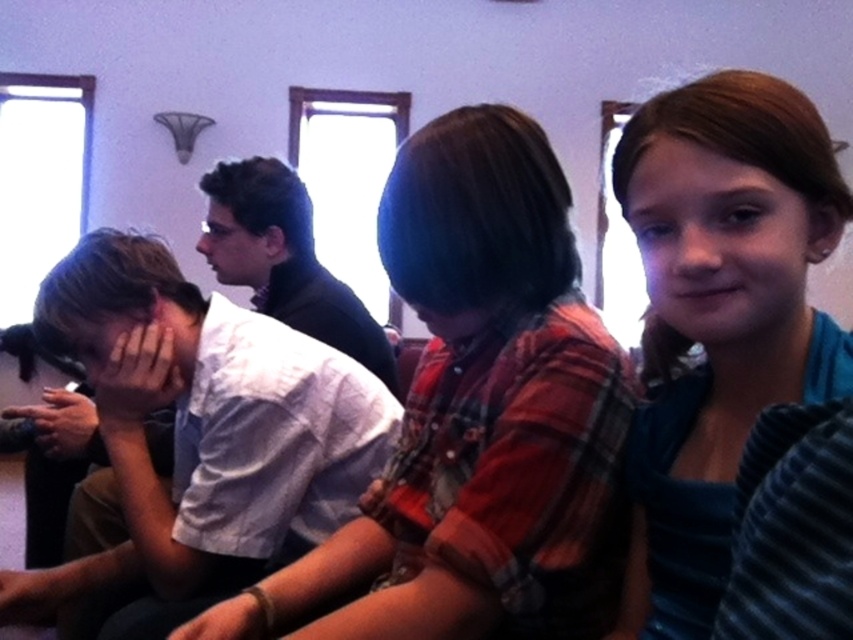
Question: Which point is farther from the camera taking this photo?

Choices:
 (A) (303, 484)
 (B) (231, 259)

Answer: (B)

Question: Which object is the closest to the matte black hair at center?

Choices:
 (A) dark blue shirt at center
 (B) smooth skin hand at center left

Answer: (A)

Question: From the image, what is the correct spatial relationship of smooth brown hair at upper right in relation to dark blue shirt at center?

Choices:
 (A) right
 (B) left

Answer: (A)

Question: Does smooth brown hair at upper right have a lesser width compared to smooth skin face at upper right?

Choices:
 (A) yes
 (B) no

Answer: (B)

Question: Is dark blue shirt at center wider than matte black hair at center?

Choices:
 (A) no
 (B) yes

Answer: (B)

Question: Estimate the real-world distances between objects in this image. Which object is closer to the dark blue shirt at center?

Choices:
 (A) matte black hair at center
 (B) white shirt at left

Answer: (A)